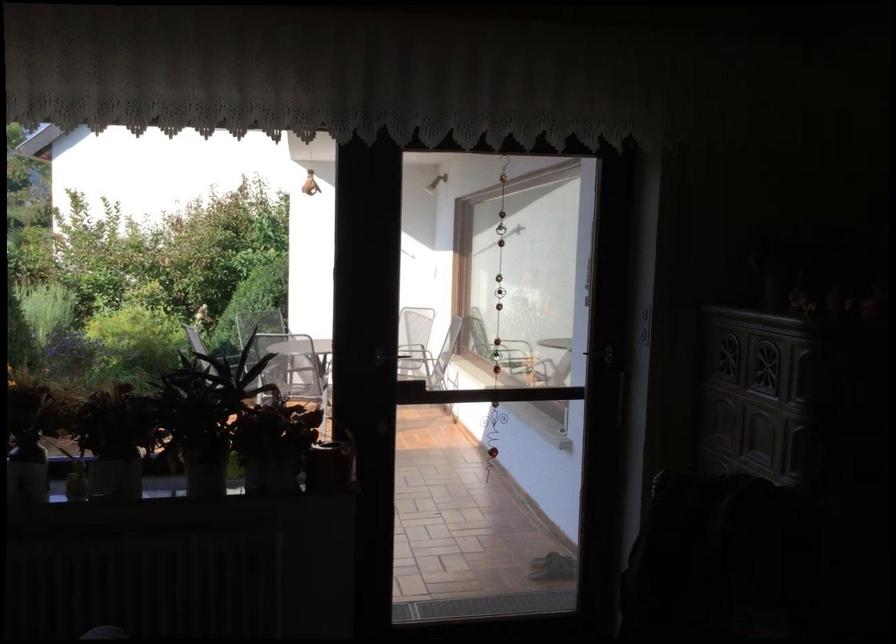
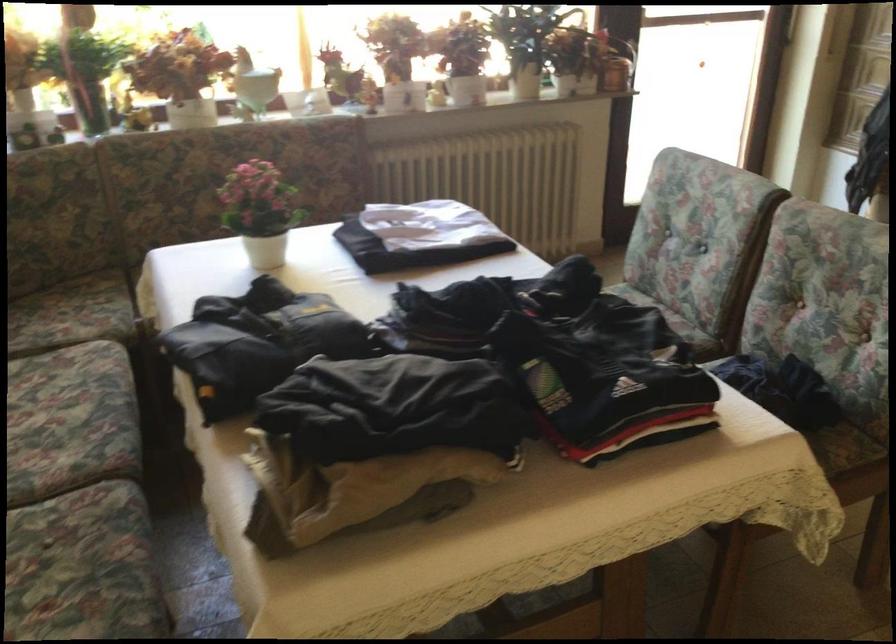
In the second image, find the point that corresponds to (79,469) in the first image.

(467, 84)